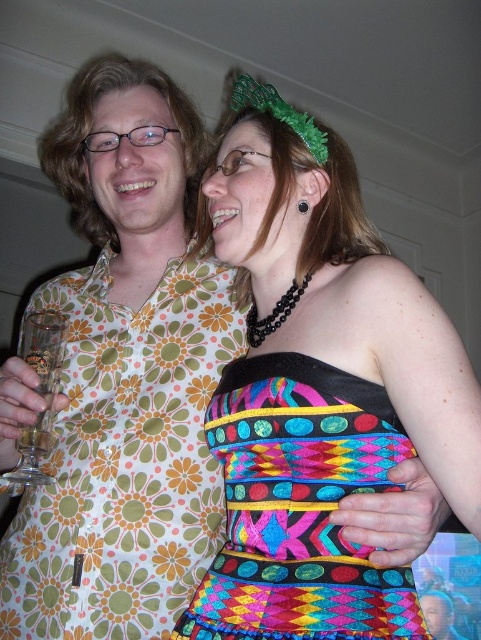
You are standing in the room and want to touch the point at coordinates (300, 508). Which object will your hand reach?

The point at coordinates (300, 508) is on the multicolored woven dress at center, so your hand will reach the multicolored woven dress at center.